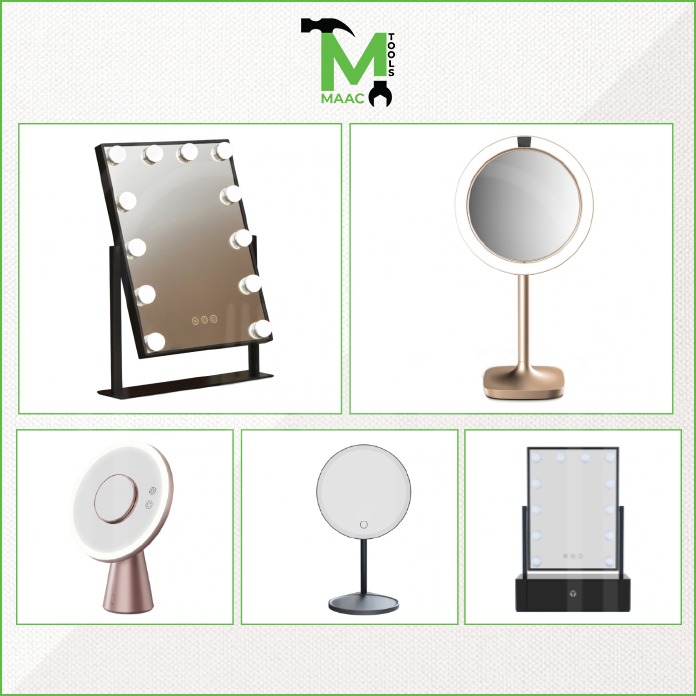
Identify the location of rectangle mirror. The width and height of the screenshot is (696, 696). (180, 230).